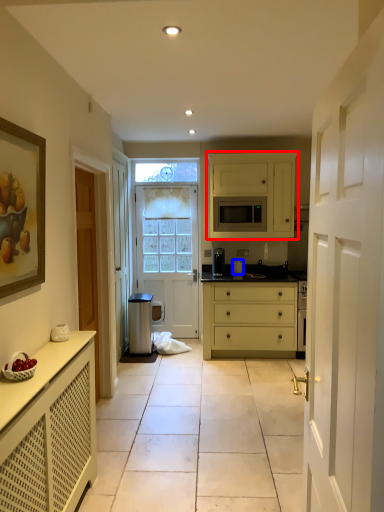
Question: Which object appears closest to the camera in this image, cabinetry (highlighted by a red box) or appliance (highlighted by a blue box)?

Choices:
 (A) cabinetry
 (B) appliance

Answer: (A)